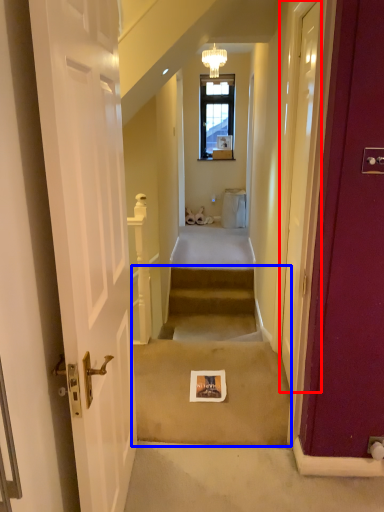
Question: Among these objects, which one is farthest to the camera, door (highlighted by a red box) or stairwell (highlighted by a blue box)?

Choices:
 (A) door
 (B) stairwell

Answer: (B)